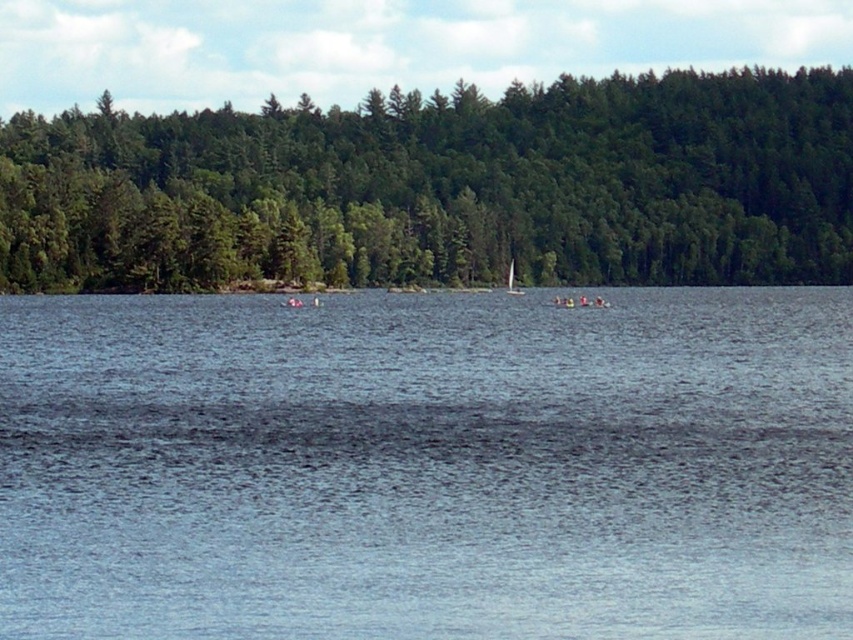
Who is more forward, (573, 586) or (515, 292)?

Point (573, 586) is more forward.

Is blue water at center thinner than white glossy sailboat at center?

In fact, blue water at center might be wider than white glossy sailboat at center.

Between point (432, 428) and point (511, 268), which one is positioned behind?

The point (511, 268) is more distant.

This screenshot has height=640, width=853. Find the location of `blue water at center`. blue water at center is located at coordinates (427, 467).

Does blue water at center have a smaller size compared to green matte forest at center?

Correct, blue water at center occupies less space than green matte forest at center.

Does blue water at center appear under green matte forest at center?

Correct, blue water at center is located below green matte forest at center.

In order to click on blue water at center in this screenshot , I will do `click(427, 467)`.

Does green matte forest at center have a lesser width compared to white glossy sailboat at center?

No.

Can you confirm if green matte forest at center is taller than white glossy sailboat at center?

Indeed, green matte forest at center has a greater height compared to white glossy sailboat at center.

The width and height of the screenshot is (853, 640). Describe the element at coordinates (444, 188) in the screenshot. I see `green matte forest at center` at that location.

Identify the location of green matte forest at center. The height and width of the screenshot is (640, 853). (444, 188).